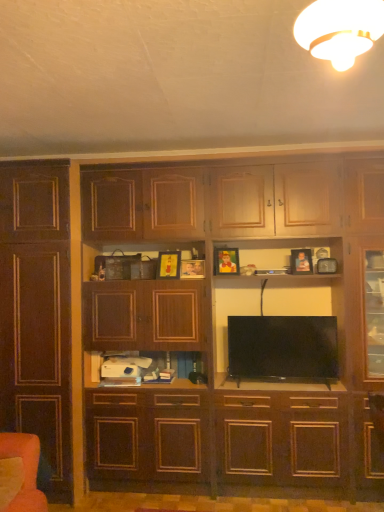
This screenshot has height=512, width=384. Find the location of `orange fabric armchair at lower left`. orange fabric armchair at lower left is located at coordinates (24, 471).

The image size is (384, 512). What are the coordinates of `dark wood cabinet at left` in the screenshot? It's located at (37, 314).

Considering the positions of point (27, 378) and point (147, 373), is point (27, 378) closer or farther from the camera than point (147, 373)?

Point (27, 378) appears to be closer to the viewer than point (147, 373).

Is dark wood cabinet at left thinner than matte brown cabinet at center?

Incorrect, the width of dark wood cabinet at left is not less than that of matte brown cabinet at center.

At what (x,y) coordinates should I click in order to perform the action: click on shelf to the right of dark wood cabinet at left. Please return your answer as a coordinate pair (x, y). Looking at the image, I should click on (189, 366).

Is black glossy tv at center not inside orange fabric armchair at lower left?

Absolutely, black glossy tv at center is external to orange fabric armchair at lower left.

Is black glossy tv at center bigger than orange fabric armchair at lower left?

Incorrect, black glossy tv at center is not larger than orange fabric armchair at lower left.

There is a orange fabric armchair at lower left. What are the coordinates of `television above it (from a real-world perspective)` in the screenshot? It's located at (283, 349).

From the image's perspective, which is above, black glossy tv at center or orange fabric armchair at lower left?

black glossy tv at center, from the image's perspective.

Is dark wood cabinet at left oriented towards black glossy tv at center?

No.

Is dark wood cabinet at left at the right side of black glossy tv at center?

No, dark wood cabinet at left is not to the right of black glossy tv at center.

Which object is more forward, dark wood cabinet at left or black glossy tv at center?

dark wood cabinet at left.

Which of these two, orange fabric armchair at lower left or dark wood cupboard at center, is wider?

dark wood cupboard at center is wider.

Between point (37, 462) and point (105, 446), which one is positioned in front?

The point (37, 462) is closer to the camera.

From the image's perspective, is orange fabric armchair at lower left above dark wood cupboard at center?

Incorrect, from the image's perspective, orange fabric armchair at lower left is lower than dark wood cupboard at center.

Is orange fabric armchair at lower left behind dark wood cupboard at center?

No, it is not.

Is dark wood cabinet at left in front of orange fabric armchair at lower left?

No, it is behind orange fabric armchair at lower left.

Looking at this image, is dark wood cabinet at left oriented towards orange fabric armchair at lower left?

Yes, dark wood cabinet at left is turned towards orange fabric armchair at lower left.

Which of these two, dark wood cabinet at left or orange fabric armchair at lower left, is wider?

dark wood cabinet at left is wider.

Is point (45, 450) positioned before point (6, 433)?

No, (45, 450) is behind (6, 433).

Can you confirm if matte brown cabinet at center is taller than orange fabric armchair at lower left?

No, matte brown cabinet at center is not taller than orange fabric armchair at lower left.

From a real-world perspective, is matte brown cabinet at center positioned over orange fabric armchair at lower left based on gravity?

Yes, from a real-world perspective, matte brown cabinet at center is above orange fabric armchair at lower left.

From the image's perspective, is matte brown cabinet at center located above orange fabric armchair at lower left?

Answer: Yes, from the image's perspective, matte brown cabinet at center is on top of orange fabric armchair at lower left.

Can you confirm if dark wood cupboard at center is thinner than black glossy tv at center?

In fact, dark wood cupboard at center might be wider than black glossy tv at center.

From a real-world perspective, which is physically below, dark wood cupboard at center or black glossy tv at center?

black glossy tv at center is physically lower.

Does point (71, 270) appear closer or farther from the camera than point (264, 347)?

Point (71, 270) is closer to the camera than point (264, 347).

From the image's perspective, would you say dark wood cupboard at center is positioned over black glossy tv at center?

Yes.

I want to click on cabinetry on the left of the matte brown cabinet at center, so click(37, 314).

The height and width of the screenshot is (512, 384). Find the location of `television that is on the right side of orange fabric armchair at lower left`. television that is on the right side of orange fabric armchair at lower left is located at coordinates (283, 349).

Based on the photo, looking at the image, which one is located further to dark wood cabinet at left, black glossy tv at center or matte brown cabinet at center?

black glossy tv at center is further to dark wood cabinet at left.

Considering their positions, is matte brown cabinet at center positioned closer to orange fabric armchair at lower left than dark wood cabinet at left?

dark wood cabinet at left lies closer to orange fabric armchair at lower left than the other object.

When comparing their distances from dark wood cupboard at center, does dark wood cabinet at left or orange fabric armchair at lower left seem further?

orange fabric armchair at lower left.

Looking at the image, which one is located closer to matte brown cabinet at center, orange fabric armchair at lower left or dark wood cabinet at left?

dark wood cabinet at left is positioned closer to the anchor matte brown cabinet at center.

When comparing their distances from orange fabric armchair at lower left, does black glossy tv at center or dark wood cupboard at center seem closer?

The object closer to orange fabric armchair at lower left is dark wood cupboard at center.

Which object lies further to the anchor point orange fabric armchair at lower left, matte brown cabinet at center or black glossy tv at center?

black glossy tv at center lies further to orange fabric armchair at lower left than the other object.

Which object lies nearer to the anchor point dark wood cupboard at center, dark wood cabinet at left or matte brown cabinet at center?

Among the two, dark wood cabinet at left is located nearer to dark wood cupboard at center.

Considering their positions, is dark wood cupboard at center positioned closer to matte brown cabinet at center than black glossy tv at center?

black glossy tv at center.

Find the location of a particular element. shelf between orange fabric armchair at lower left and dark wood cupboard at center from left to right is located at coordinates (189, 366).

The image size is (384, 512). I want to click on cupboard situated between matte brown cabinet at center and black glossy tv at center from left to right, so (190, 315).

Locate an element on the screen. The height and width of the screenshot is (512, 384). shelf situated between orange fabric armchair at lower left and black glossy tv at center from left to right is located at coordinates (189, 366).

The image size is (384, 512). What are the coordinates of `armchair between dark wood cabinet at left and dark wood cupboard at center in the horizontal direction` in the screenshot? It's located at (24, 471).